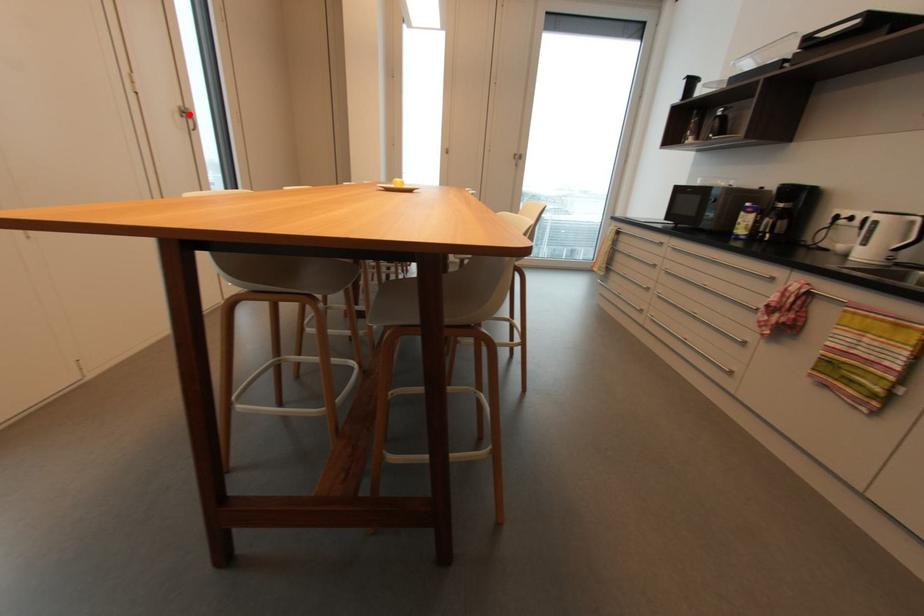
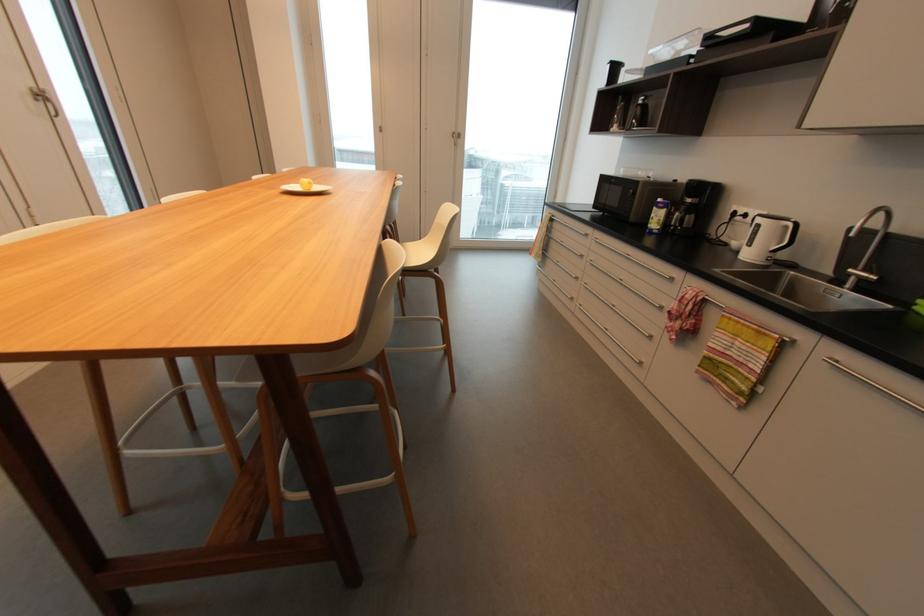
Find the pixel in the second image that matches the highlighted location in the first image.

(49, 98)